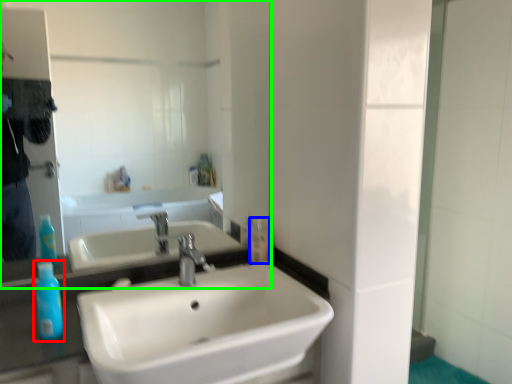
Question: Estimate the real-world distances between objects in this image. Which object is closer to mouthwash (highlighted by a red box), mouthwash (highlighted by a blue box) or mirror (highlighted by a green box)?

Choices:
 (A) mouthwash
 (B) mirror

Answer: (A)